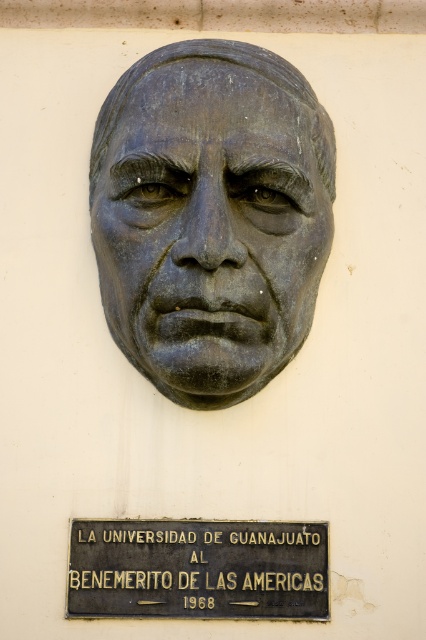
Question: Where is bronze sculpture at center located in relation to bronze plaque at center in the image?

Choices:
 (A) above
 (B) below

Answer: (A)

Question: Does bronze sculpture at center appear on the left side of bronze plaque at center?

Choices:
 (A) no
 (B) yes

Answer: (B)

Question: Is bronze sculpture at center closer to the viewer compared to bronze plaque at center?

Choices:
 (A) yes
 (B) no

Answer: (A)

Question: Which object appears closest to the camera in this image?

Choices:
 (A) bronze plaque at center
 (B) bronze sculpture at center

Answer: (B)